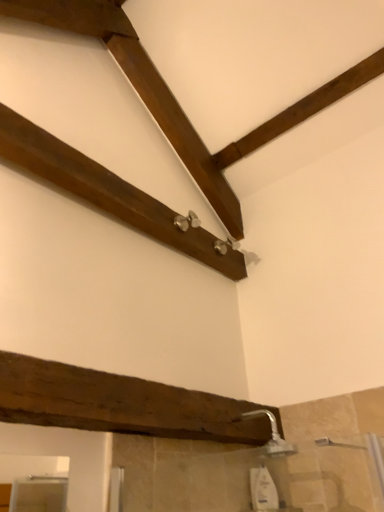
You are a GUI agent. You are given a task and a screenshot of the screen. Output one action in this format:
    pyautogui.click(x=<x>, y=<y>)
    Task: Click on the silver metallic shower head at lower right
    The image size is (384, 512).
    Given the screenshot: What is the action you would take?
    pyautogui.click(x=271, y=433)

The width and height of the screenshot is (384, 512). Describe the element at coordinates (271, 433) in the screenshot. I see `silver metallic shower head at lower right` at that location.

I want to click on silver metallic shower head at lower right, so click(271, 433).